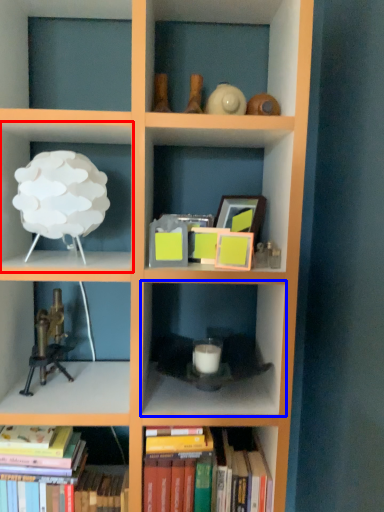
Question: Which point is closer to the camera, shelf (highlighted by a red box) or shelf (highlighted by a blue box)?

Choices:
 (A) shelf
 (B) shelf

Answer: (A)